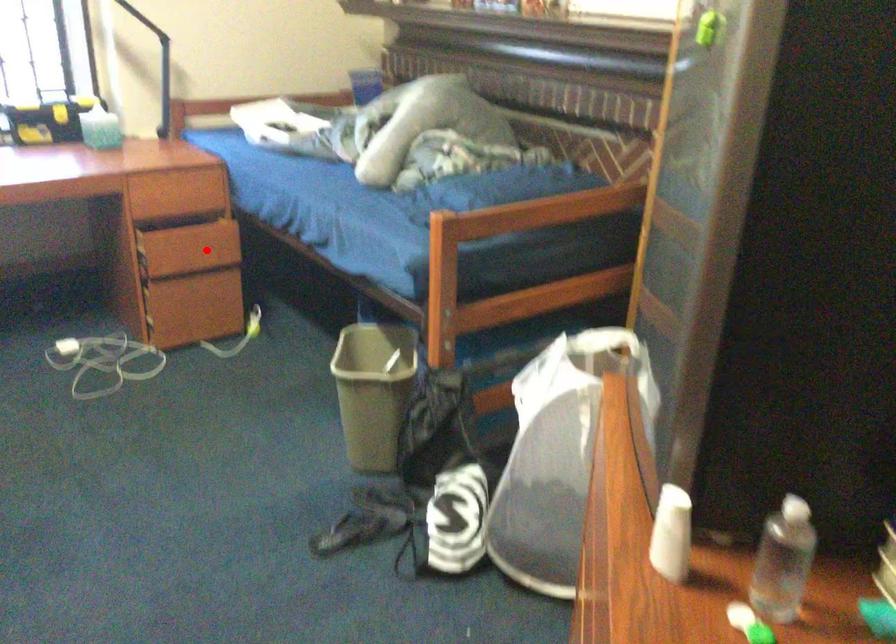
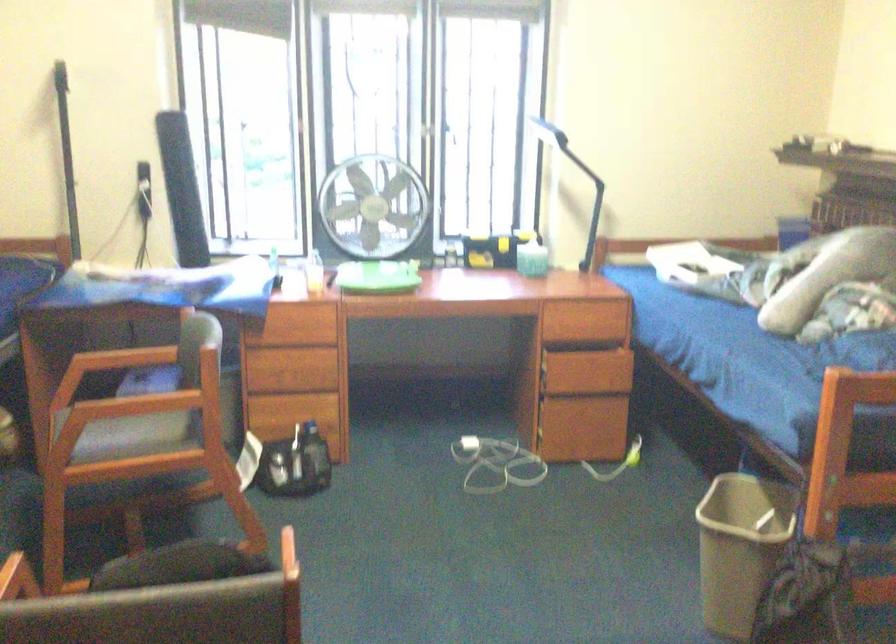
In the second image, find the point that corresponds to the highlighted location in the first image.

(601, 375)